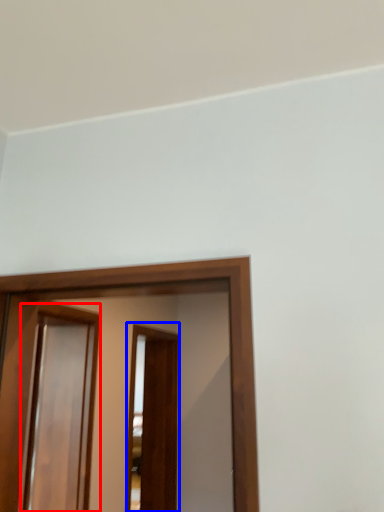
Question: Which point is closer to the camera, screen door (highlighted by a red box) or screen door (highlighted by a blue box)?

Choices:
 (A) screen door
 (B) screen door

Answer: (A)